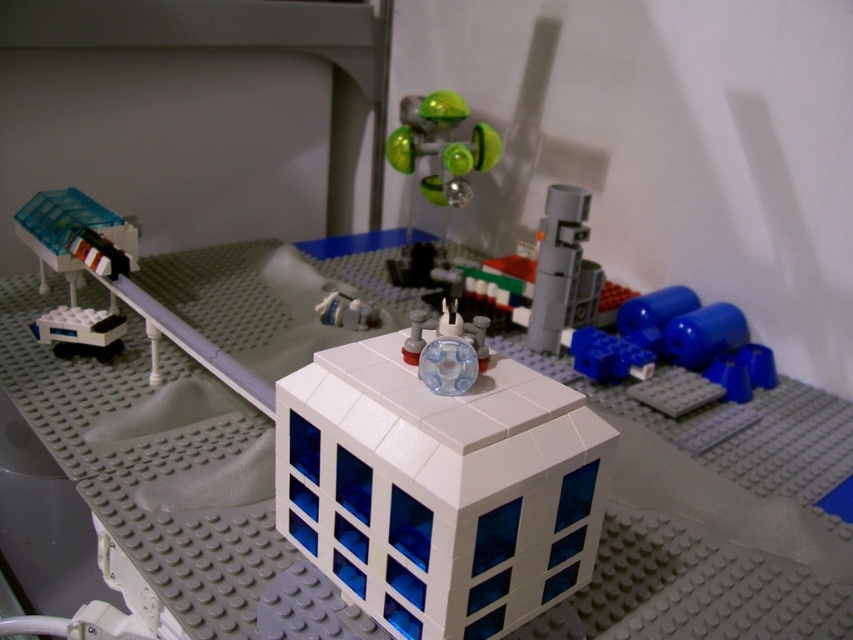
Is point (126, 253) in front of point (113, 349)?

No, (126, 253) is behind (113, 349).

Between point (105, 228) and point (51, 314), which one is positioned behind?

The point (105, 228) is behind.

At what (x,y) coordinates should I click in order to perform the action: click on translucent blue plastic train car at left. Please return your answer as a coordinate pair (x, y). Looking at the image, I should click on (68, 232).

Is white matte building at center to the right of translucent blue plastic train car at left from the viewer's perspective?

Yes, white matte building at center is to the right of translucent blue plastic train car at left.

Can you confirm if white matte building at center is positioned below translucent blue plastic train car at left?

Yes.

Is point (490, 481) positioned behind point (56, 244)?

No, it is not.

I want to click on white matte building at center, so click(x=439, y=488).

Is point (486, 436) more distant than point (589, 275)?

No, it is in front of (589, 275).

Does white matte building at center have a larger size compared to satin gray cylinder at center?

Yes.

Does point (492, 464) lie behind point (550, 211)?

No.

Locate an element on the screen. This screenshot has height=640, width=853. white matte building at center is located at coordinates (439, 488).